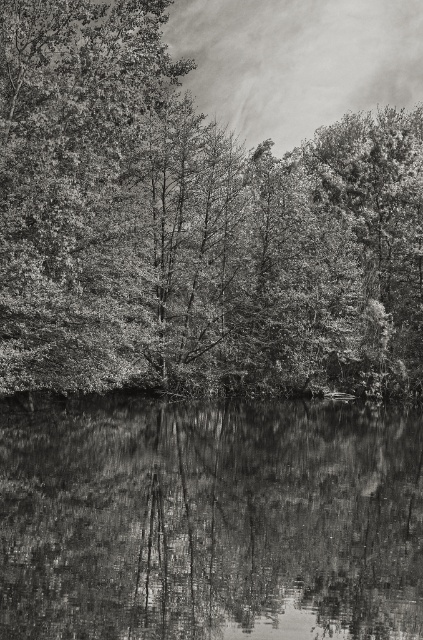
You are an artist planning to paint this scene. You want to ensure the smooth bark tree at upper center and the smooth reflective water at bottom are proportionally accurate. Which object should you make wider in your painting?

The smooth bark tree at upper center should be made wider in the painting since its width surpasses that of the smooth reflective water at bottom according to the description.